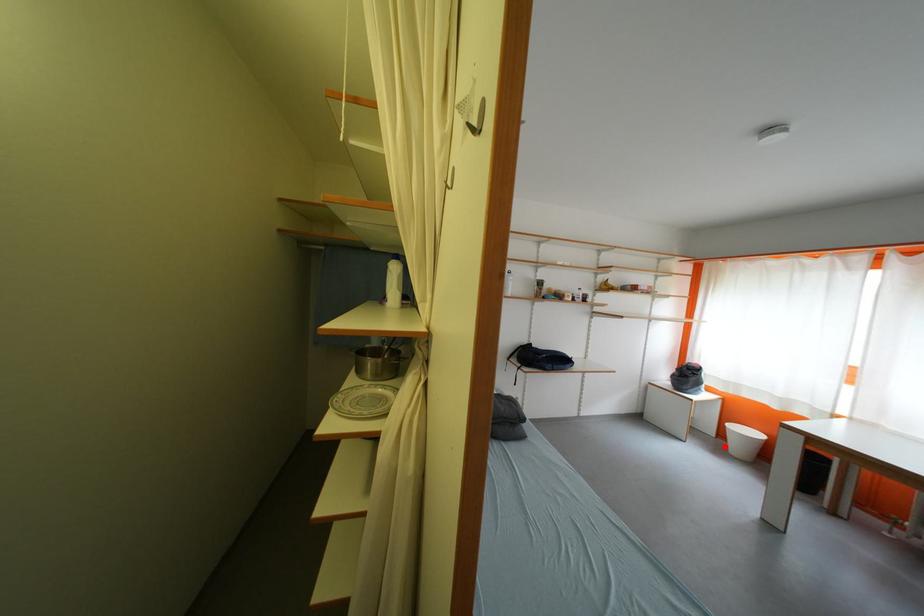
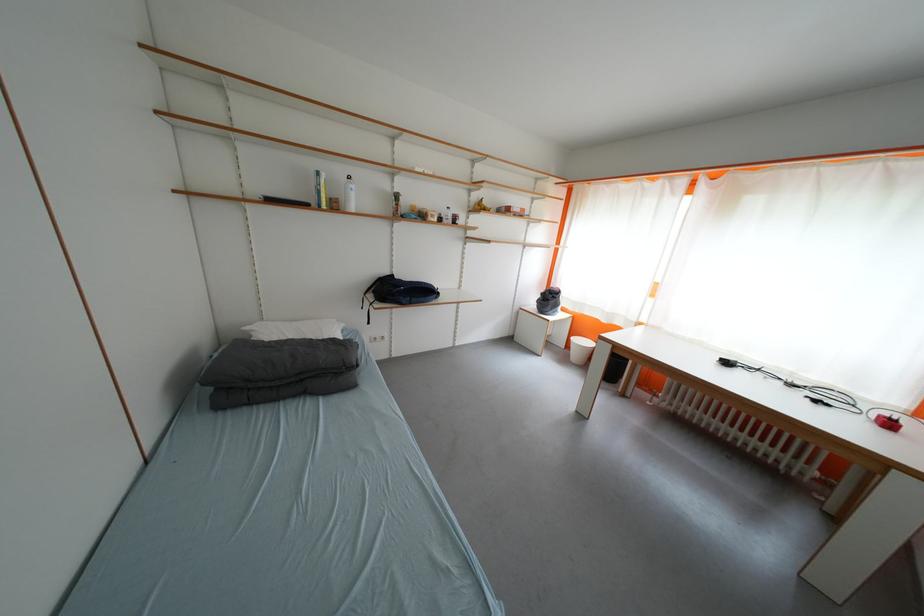
Question: I am providing you with two images of the same scene from different viewpoints. A red point is shown in image1. For the corresponding object point in image2, is it positioned nearer or farther from the camera?

Choices:
 (A) Nearer
 (B) Farther

Answer: (A)